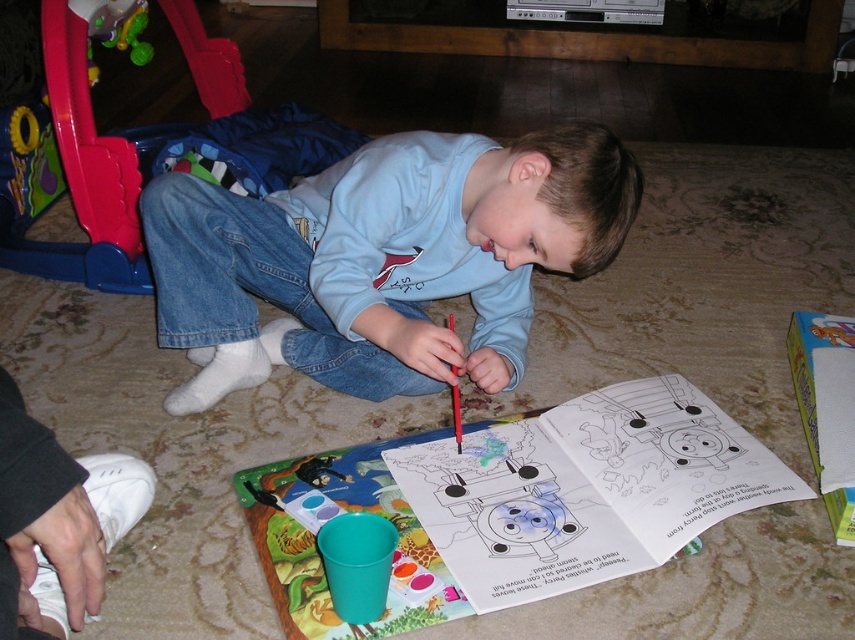
Question: Is light blue cotton shirt at center below matte plastic coloring book at center?

Choices:
 (A) yes
 (B) no

Answer: (B)

Question: Among these points, which one is nearest to the camera?

Choices:
 (A) (455, 406)
 (B) (209, 154)
 (C) (447, 472)

Answer: (A)

Question: Is matte plastic coloring book at center thinner than rubberized plastic walker at left?

Choices:
 (A) yes
 (B) no

Answer: (B)

Question: Which point is farther to the camera?

Choices:
 (A) matte plastic crayon at lower center
 (B) matte plastic coloring book at center

Answer: (A)

Question: Which object appears farthest from the camera in this image?

Choices:
 (A) rubberized plastic walker at left
 (B) matte plastic coloring book at center
 (C) light blue cotton shirt at center
 (D) matte plastic crayon at lower center

Answer: (A)

Question: Can you confirm if light blue cotton shirt at center is wider than matte plastic crayon at lower center?

Choices:
 (A) yes
 (B) no

Answer: (A)